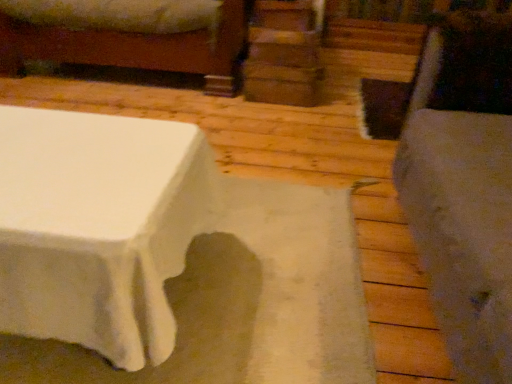
Describe the element at coordinates (464, 189) in the screenshot. I see `fuzzy gray swivel chair at right` at that location.

Locate an element on the screen. The width and height of the screenshot is (512, 384). fuzzy gray swivel chair at right is located at coordinates (464, 189).

This screenshot has width=512, height=384. What are the coordinates of `wooden bed frame at upper left` in the screenshot? It's located at (130, 35).

What do you see at coordinates (130, 35) in the screenshot?
I see `wooden bed frame at upper left` at bounding box center [130, 35].

At what (x,y) coordinates should I click in order to perform the action: click on fuzzy gray swivel chair at right. Please return your answer as a coordinate pair (x, y). This screenshot has height=384, width=512. Looking at the image, I should click on (464, 189).

Between fuzzy gray swivel chair at right and wooden bed frame at upper left, which one appears on the right side from the viewer's perspective?

→ From the viewer's perspective, fuzzy gray swivel chair at right appears more on the right side.

Between fuzzy gray swivel chair at right and wooden bed frame at upper left, which one is positioned in front?

Positioned in front is fuzzy gray swivel chair at right.

Does point (498, 155) come farther from viewer compared to point (212, 94)?

No, (498, 155) is closer to viewer.

Based on the photo, from the image's perspective, does fuzzy gray swivel chair at right appear lower than wooden bed frame at upper left?

Correct, fuzzy gray swivel chair at right appears lower than wooden bed frame at upper left in the image.

From a real-world perspective, is fuzzy gray swivel chair at right physically above wooden bed frame at upper left?

Yes, from a real-world perspective, fuzzy gray swivel chair at right is above wooden bed frame at upper left.

Which object is wider, fuzzy gray swivel chair at right or wooden bed frame at upper left?

With larger width is wooden bed frame at upper left.

Who is shorter, fuzzy gray swivel chair at right or wooden bed frame at upper left?

wooden bed frame at upper left.

Considering the sizes of objects fuzzy gray swivel chair at right and wooden bed frame at upper left in the image provided, who is smaller, fuzzy gray swivel chair at right or wooden bed frame at upper left?

Smaller between the two is fuzzy gray swivel chair at right.

Looking at this image, is wooden bed frame at upper left inside fuzzy gray swivel chair at right?

That's incorrect, wooden bed frame at upper left is not inside fuzzy gray swivel chair at right.

Would you say fuzzy gray swivel chair at right is a long distance from wooden bed frame at upper left?

Absolutely, fuzzy gray swivel chair at right is distant from wooden bed frame at upper left.

Is fuzzy gray swivel chair at right facing away from wooden bed frame at upper left?

No, wooden bed frame at upper left is not at the back of fuzzy gray swivel chair at right.

How different are the orientations of fuzzy gray swivel chair at right and wooden bed frame at upper left in degrees?

91.6 degrees separate the facing orientations of fuzzy gray swivel chair at right and wooden bed frame at upper left.

How much distance is there between fuzzy gray swivel chair at right and wooden bed frame at upper left?

fuzzy gray swivel chair at right is 5.27 feet from wooden bed frame at upper left.

The height and width of the screenshot is (384, 512). In order to click on swivel chair that is in front of the wooden bed frame at upper left in this screenshot , I will do `click(464, 189)`.

Is wooden bed frame at upper left to the left of fuzzy gray swivel chair at right from the viewer's perspective?

Yes.

Between wooden bed frame at upper left and fuzzy gray swivel chair at right, which one is positioned behind?

wooden bed frame at upper left is behind.

Is point (237, 20) positioned in front of point (453, 233)?

No, it is behind (453, 233).

From the image's perspective, is wooden bed frame at upper left located above fuzzy gray swivel chair at right?

Yes, from the image's perspective, wooden bed frame at upper left is on top of fuzzy gray swivel chair at right.

From a real-world perspective, is wooden bed frame at upper left over fuzzy gray swivel chair at right?

No.

Considering the relative sizes of wooden bed frame at upper left and fuzzy gray swivel chair at right in the image provided, is wooden bed frame at upper left wider than fuzzy gray swivel chair at right?

Correct, the width of wooden bed frame at upper left exceeds that of fuzzy gray swivel chair at right.

Considering the sizes of wooden bed frame at upper left and fuzzy gray swivel chair at right in the image, is wooden bed frame at upper left taller or shorter than fuzzy gray swivel chair at right?

Considering their sizes, wooden bed frame at upper left has less height than fuzzy gray swivel chair at right.

Is wooden bed frame at upper left smaller than fuzzy gray swivel chair at right?

No.

From the picture: Can we say wooden bed frame at upper left lies outside fuzzy gray swivel chair at right?

Absolutely, wooden bed frame at upper left is external to fuzzy gray swivel chair at right.

Based on the photo, is wooden bed frame at upper left placed right next to fuzzy gray swivel chair at right?

No, wooden bed frame at upper left is not next to fuzzy gray swivel chair at right.

Is wooden bed frame at upper left aimed at fuzzy gray swivel chair at right?

Yes, wooden bed frame at upper left is facing fuzzy gray swivel chair at right.

What's the angular difference between wooden bed frame at upper left and fuzzy gray swivel chair at right's facing directions?

There is a 91.6-degree angle between the facing directions of wooden bed frame at upper left and fuzzy gray swivel chair at right.

The image size is (512, 384). In order to click on swivel chair in front of the wooden bed frame at upper left in this screenshot , I will do `click(464, 189)`.

Where is `furniture that is behind the fuzzy gray swivel chair at right`? This screenshot has width=512, height=384. furniture that is behind the fuzzy gray swivel chair at right is located at coordinates (130, 35).

Find the location of a particular element. swivel chair in front of the wooden bed frame at upper left is located at coordinates (464, 189).